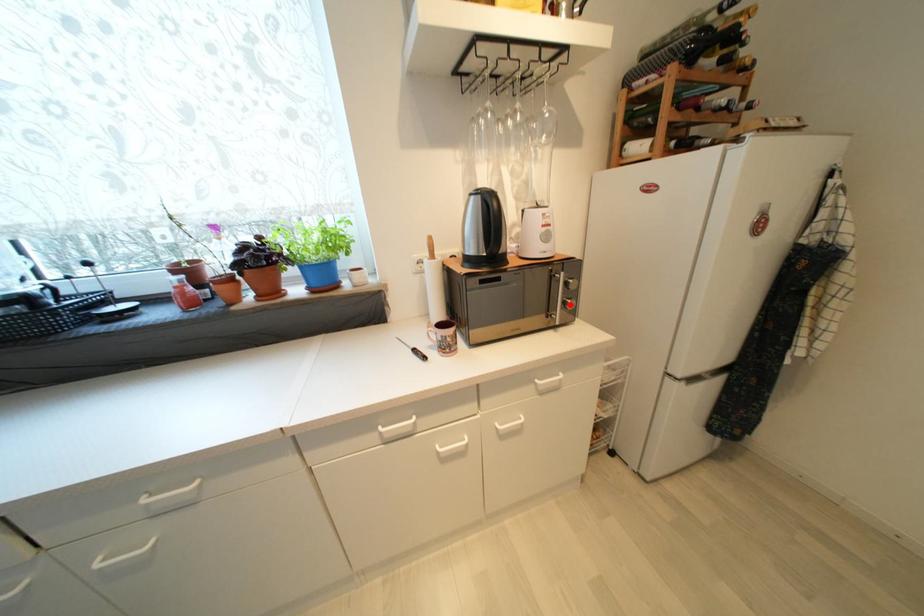
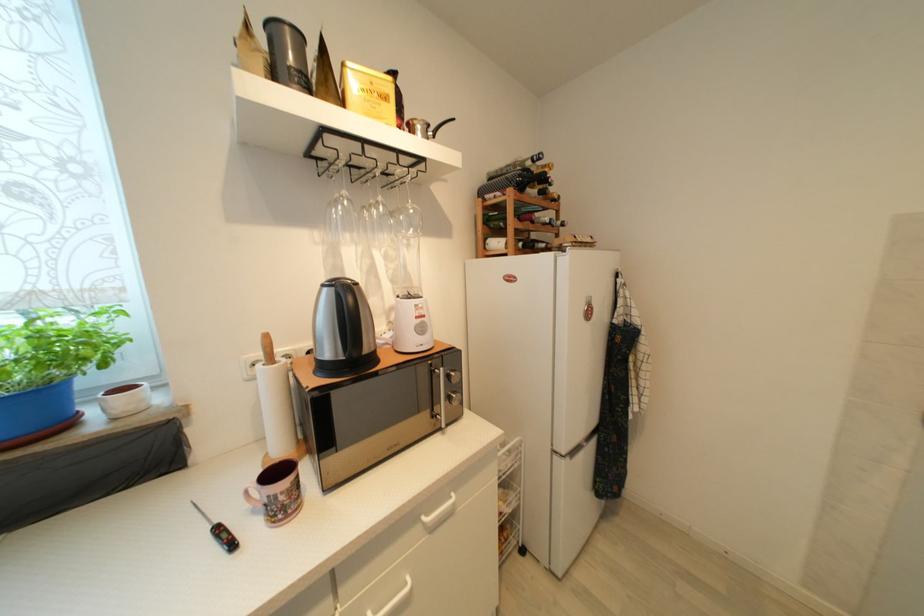
Question: I am providing you with two images of the same scene from different viewpoints. Image1 has a red point marked. In image2, the corresponding 3D location appears at what relative position? Reply with the corresponding letter.

Choices:
 (A) Closer
 (B) Farther

Answer: (B)